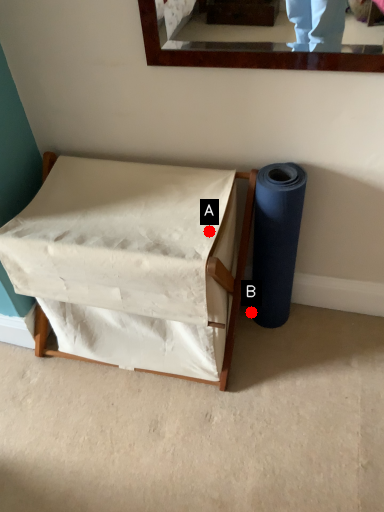
Question: Two points are circled on the image, labeled by A and B beside each circle. Which point is further to the camera?

Choices:
 (A) A is further
 (B) B is further

Answer: (B)